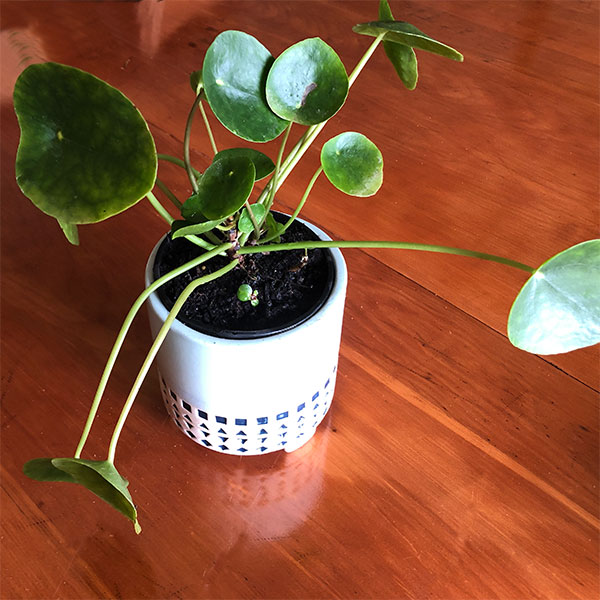
This screenshot has width=600, height=600. I want to click on white plant holder, so click(x=270, y=393).